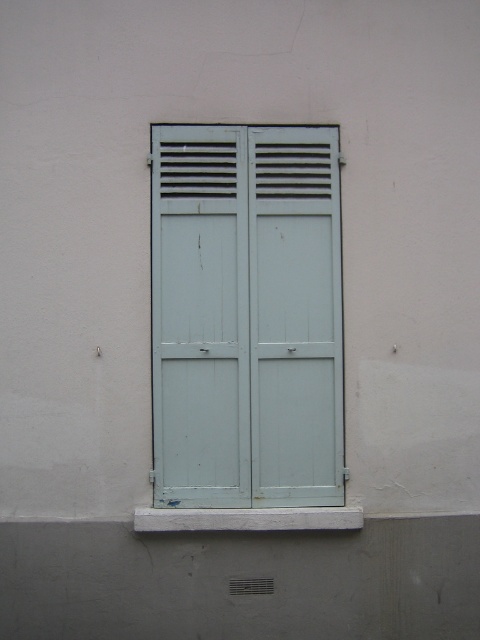
Does light blue wood door at center appear over light blue wooden door at center?

Indeed, light blue wood door at center is positioned over light blue wooden door at center.

Does point (211, 173) come behind point (276, 416)?

That is True.

Where is `light blue wood door at center`? light blue wood door at center is located at coordinates (200, 316).

Does light blue wood door at center have a smaller size compared to white concrete at lower center?

Incorrect, light blue wood door at center is not smaller in size than white concrete at lower center.

Is light blue wood door at center below white concrete at lower center?

Actually, light blue wood door at center is above white concrete at lower center.

Which is in front, point (204, 369) or point (251, 515)?

Positioned in front is point (251, 515).

The width and height of the screenshot is (480, 640). I want to click on light blue wood door at center, so click(200, 316).

Is light blue wood shutters at center positioned behind light blue wooden door at center?

That is False.

Which is more to the left, light blue wood shutters at center or light blue wooden door at center?

Positioned to the left is light blue wood shutters at center.

Does point (182, 321) come closer to viewer compared to point (298, 472)?

Yes, point (182, 321) is in front of point (298, 472).

At what (x,y) coordinates should I click in order to perform the action: click on light blue wood shutters at center. Please return your answer as a coordinate pair (x, y). This screenshot has width=480, height=640. Looking at the image, I should click on (247, 316).